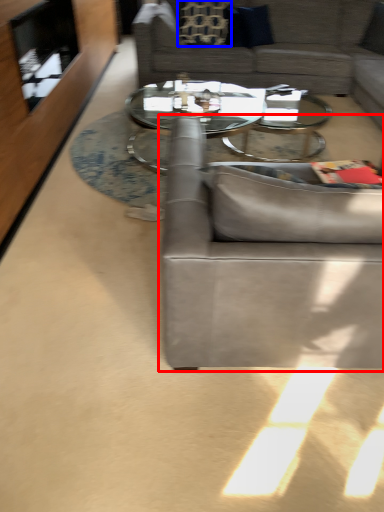
Question: Which object is further to the camera taking this photo, studio couch (highlighted by a red box) or pillow (highlighted by a blue box)?

Choices:
 (A) studio couch
 (B) pillow

Answer: (B)